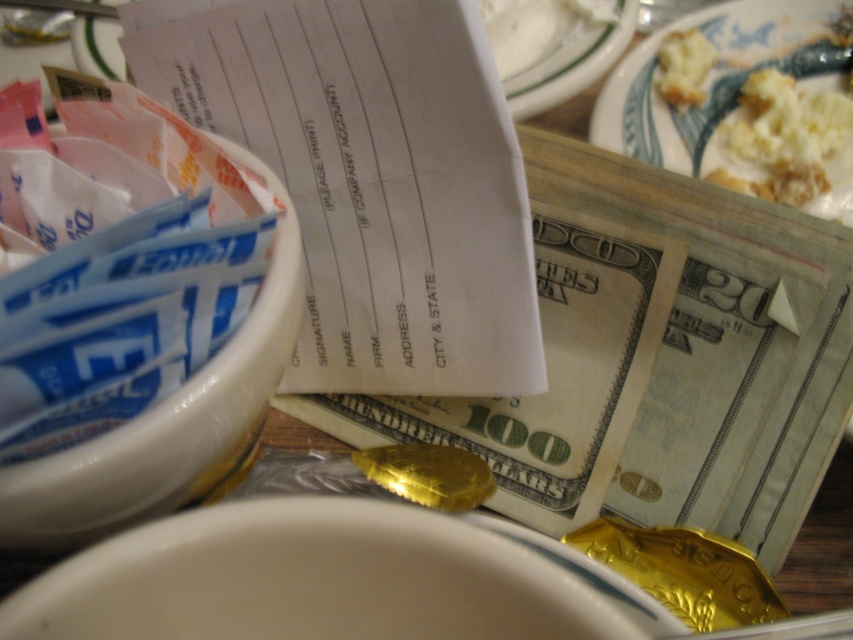
You are a server at a restaurant. You need to place a tall dessert on the table. The dessert is taller than both the white ceramic plate at upper right and white glossy bowl at upper left. Where should you place it so it fits?

The dessert should be placed on the white ceramic plate at upper right because it has a greater height compared to the white glossy bowl at upper left, making it more suitable for supporting taller items.

You are a customer at a restaurant and you see the white paper receipt at center and the golden crumbly bread at upper right on the table. Which item is closer to the edge of the table?

The golden crumbly bread at upper right is closer to the edge of the table because it is positioned above the white paper receipt at center, which is located below it.